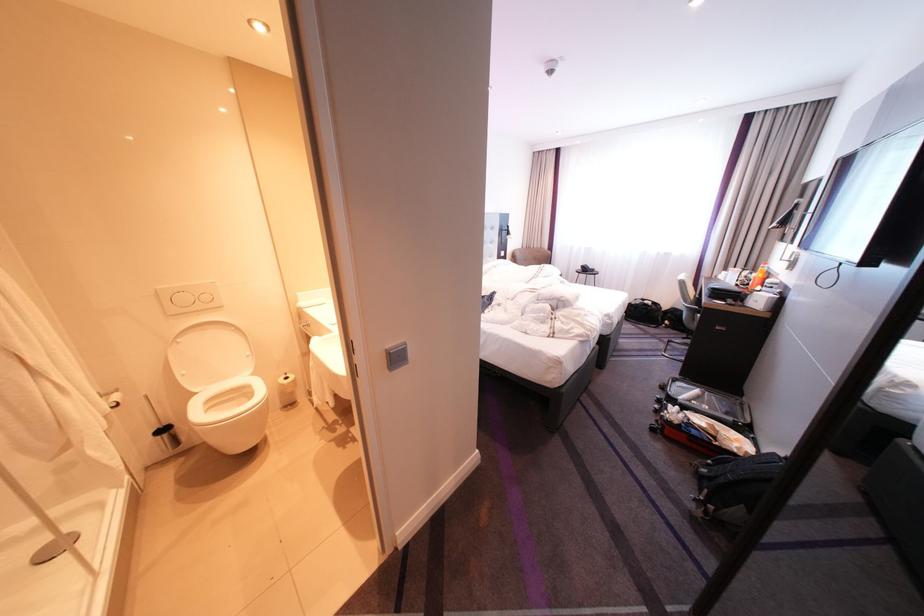
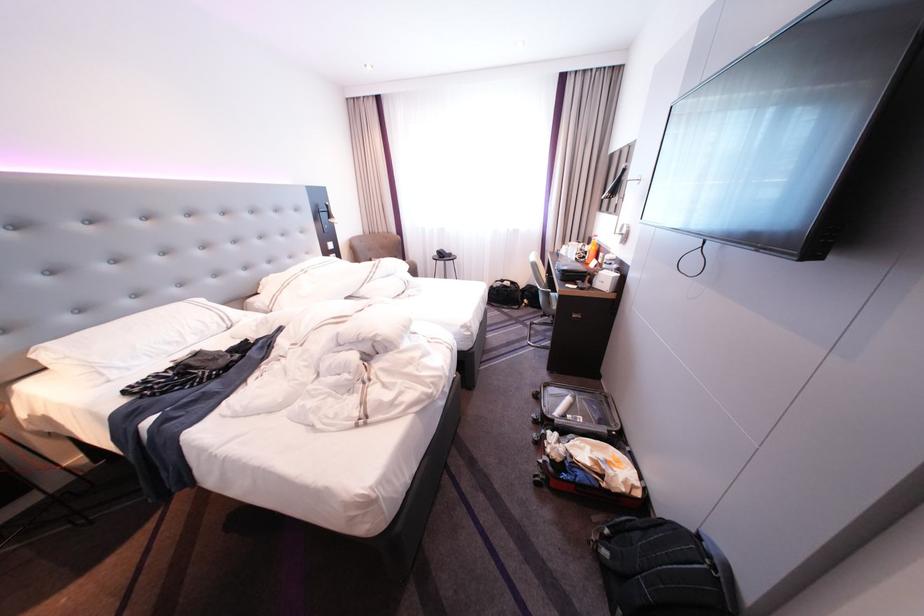
In the second image, find the point that corresponds to pixel 687 334 in the first image.

(546, 314)